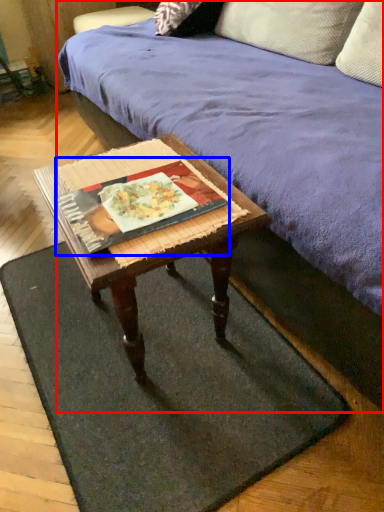
Question: Which of the following is the closest to the observer, studio couch (highlighted by a red box) or book (highlighted by a blue box)?

Choices:
 (A) studio couch
 (B) book

Answer: (A)